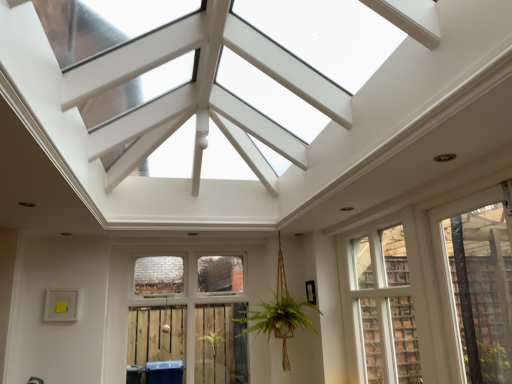
In order to face clear glass window at center, which appears as the third window when viewed from the right, should I rotate leftwards or rightwards?

It's best to rotate left around 8.757 degrees.

This screenshot has height=384, width=512. What do you see at coordinates (479, 281) in the screenshot?
I see `transparent plastic window at right, the first window positioned from the right` at bounding box center [479, 281].

Locate an element on the screen. white wood window at center, the second window from the right is located at coordinates (383, 308).

Based on the photo, would you consider clear glass window at center, arranged as the first window when viewed from the left, to be distant from transparent plastic window at right, the first window positioned from the right?

clear glass window at center, arranged as the first window when viewed from the left, is far away from transparent plastic window at right, the first window positioned from the right.

From their relative heights in the image, would you say clear glass window at center, which appears as the third window when viewed from the right, is taller or shorter than transparent plastic window at right, the 3th window positioned from the left?

clear glass window at center, which appears as the third window when viewed from the right, is taller than transparent plastic window at right, the 3th window positioned from the left.

Is point (185, 260) positioned before point (503, 359)?

No.

Is clear glass window at center, which appears as the third window when viewed from the right, aimed at transparent plastic window at right, the first window positioned from the right?

Yes, clear glass window at center, which appears as the third window when viewed from the right, is facing transparent plastic window at right, the first window positioned from the right.

Can you tell me how much white wood window at center, the second window from the right, and transparent plastic window at right, the 3th window positioned from the left, differ in facing direction?

The angular difference between white wood window at center, the second window from the right, and transparent plastic window at right, the 3th window positioned from the left, is 0.265 degrees.

Could you tell me if white wood window at center, marked as the second window in a left-to-right arrangement, is facing transparent plastic window at right, the 3th window positioned from the left?

No, white wood window at center, marked as the second window in a left-to-right arrangement, is not facing towards transparent plastic window at right, the 3th window positioned from the left.

From a real-world perspective, which is physically below, white wood window at center, the second window from the right, or transparent plastic window at right, the 3th window positioned from the left?

In real-world perspective, white wood window at center, the second window from the right, is lower.

How far apart are white wood window at center, the second window from the right, and transparent plastic window at right, the 3th window positioned from the left?

They are 28.43 inches apart.

In order to click on window located underneath the white wood window at center, marked as the second window in a left-to-right arrangement (from a real-world perspective) in this screenshot , I will do `click(192, 308)`.

How many degrees apart are the facing directions of white wood window at center, marked as the second window in a left-to-right arrangement, and clear glass window at center, which appears as the third window when viewed from the right?

They differ by 90 degrees in their facing directions.

Is white wood window at center, marked as the second window in a left-to-right arrangement, not inside clear glass window at center, which appears as the third window when viewed from the right?

Yes, white wood window at center, marked as the second window in a left-to-right arrangement, is outside of clear glass window at center, which appears as the third window when viewed from the right.

Is white wood window at center, marked as the second window in a left-to-right arrangement, shorter than clear glass window at center, which appears as the third window when viewed from the right?

Yes.

Which is nearer, (484,229) or (245,253)?

The point (484,229) is more forward.

Is transparent plastic window at right, the first window positioned from the right, to the right of clear glass window at center, which appears as the third window when viewed from the right, from the viewer's perspective?

Yes.

Measure the distance from transparent plastic window at right, the 3th window positioned from the left, to clear glass window at center, which appears as the third window when viewed from the right.

They are 2.23 meters apart.

Considering the sizes of objects transparent plastic window at right, the 3th window positioned from the left, and clear glass window at center, which appears as the third window when viewed from the right, in the image provided, who is wider, transparent plastic window at right, the 3th window positioned from the left, or clear glass window at center, which appears as the third window when viewed from the right,?

clear glass window at center, which appears as the third window when viewed from the right, is wider.

From a real-world perspective, is clear glass window at center, which appears as the third window when viewed from the right, beneath white wood window at center, the second window from the right?

Yes.

Can you confirm if clear glass window at center, which appears as the third window when viewed from the right, is wider than white wood window at center, the second window from the right?

Yes, clear glass window at center, which appears as the third window when viewed from the right, is wider than white wood window at center, the second window from the right.

Are clear glass window at center, arranged as the first window when viewed from the left, and white wood window at center, marked as the second window in a left-to-right arrangement, far apart?

That's right, there is a large distance between clear glass window at center, arranged as the first window when viewed from the left, and white wood window at center, marked as the second window in a left-to-right arrangement.

Can you confirm if clear glass window at center, arranged as the first window when viewed from the left, is bigger than white wood window at center, marked as the second window in a left-to-right arrangement?

Correct, clear glass window at center, arranged as the first window when viewed from the left, is larger in size than white wood window at center, marked as the second window in a left-to-right arrangement.

Between point (492, 339) and point (386, 267), which one is positioned in front?

The point (492, 339) is more forward.

Considering the sizes of objects transparent plastic window at right, the first window positioned from the right, and white wood window at center, the second window from the right, in the image provided, who is bigger, transparent plastic window at right, the first window positioned from the right, or white wood window at center, the second window from the right,?

Bigger between the two is white wood window at center, the second window from the right.

Who is shorter, transparent plastic window at right, the first window positioned from the right, or white wood window at center, marked as the second window in a left-to-right arrangement?

Standing shorter between the two is transparent plastic window at right, the first window positioned from the right.

Could you measure the distance between transparent plastic window at right, the first window positioned from the right, and white wood window at center, marked as the second window in a left-to-right arrangement?

transparent plastic window at right, the first window positioned from the right, and white wood window at center, marked as the second window in a left-to-right arrangement, are 28.43 inches apart.

There is a transparent plastic window at right, the 3th window positioned from the left. Identify the location of the 2nd window below it (from a real-world perspective). (192, 308).

Locate an element on the screen. This screenshot has height=384, width=512. window above the white wood window at center, the second window from the right (from a real-world perspective) is located at coordinates (479, 281).

Based on their spatial positions, is transparent plastic window at right, the first window positioned from the right, or clear glass window at center, which appears as the third window when viewed from the right, closer to white wood window at center, the second window from the right?

Among the two, transparent plastic window at right, the first window positioned from the right, is located nearer to white wood window at center, the second window from the right.

Which object lies further to the anchor point clear glass window at center, which appears as the third window when viewed from the right, transparent plastic window at right, the 3th window positioned from the left, or white wood window at center, marked as the second window in a left-to-right arrangement?

transparent plastic window at right, the 3th window positioned from the left.

Considering their positions, is white wood window at center, the second window from the right, positioned further to transparent plastic window at right, the 3th window positioned from the left, than clear glass window at center, which appears as the third window when viewed from the right?

clear glass window at center, which appears as the third window when viewed from the right, is positioned further to the anchor transparent plastic window at right, the 3th window positioned from the left.

Estimate the real-world distances between objects in this image. Which object is further from clear glass window at center, arranged as the first window when viewed from the left, white wood window at center, the second window from the right, or transparent plastic window at right, the first window positioned from the right?

transparent plastic window at right, the first window positioned from the right, lies further to clear glass window at center, arranged as the first window when viewed from the left, than the other object.

Based on their spatial positions, is clear glass window at center, which appears as the third window when viewed from the right, or white wood window at center, the second window from the right, closer to transparent plastic window at right, the first window positioned from the right?

white wood window at center, the second window from the right.

Based on their spatial positions, is clear glass window at center, arranged as the first window when viewed from the left, or transparent plastic window at right, the 3th window positioned from the left, further from white wood window at center, the second window from the right?

clear glass window at center, arranged as the first window when viewed from the left, is further to white wood window at center, the second window from the right.

You are a GUI agent. You are given a task and a screenshot of the screen. Output one action in this format:
    pyautogui.click(x=<x>, y=<y>)
    Task: Click on the window between clear glass window at center, arranged as the first window when viewed from the left, and transparent plastic window at right, the 3th window positioned from the left, in the horizontal direction
    This screenshot has height=384, width=512.
    Given the screenshot: What is the action you would take?
    pyautogui.click(x=383, y=308)